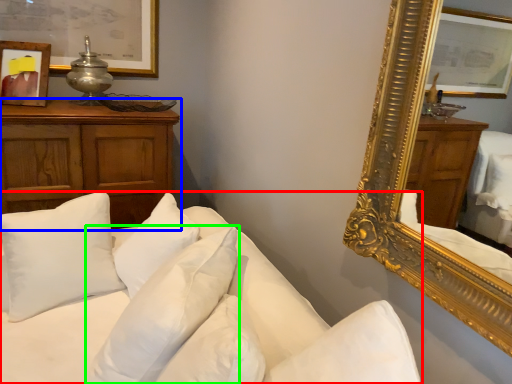
Question: Considering the real-world distances, which object is closest to studio couch (highlighted by a red box)? cabinetry (highlighted by a blue box) or pillow (highlighted by a green box).

Choices:
 (A) cabinetry
 (B) pillow

Answer: (B)